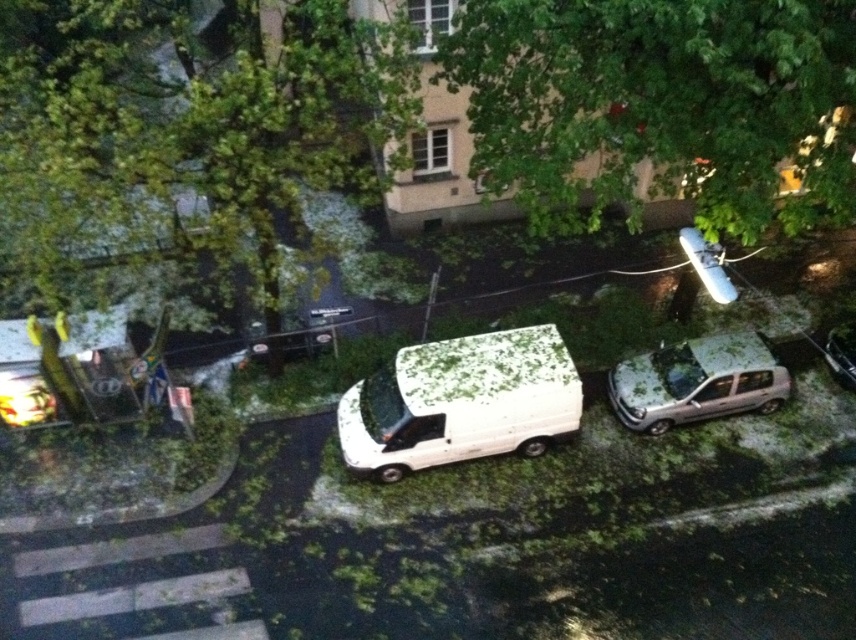
Question: Where is green leafy tree at upper center located in relation to metallic silver surfboard at upper right in the image?

Choices:
 (A) right
 (B) left

Answer: (B)

Question: Which of the following is the closest to the observer?

Choices:
 (A) green leafy tree at upper center
 (B) metallic silver surfboard at upper right

Answer: (B)

Question: Can you confirm if green leafy tree at upper center is smaller than metallic silver surfboard at upper right?

Choices:
 (A) yes
 (B) no

Answer: (A)

Question: Which object is positioned farthest from the green leafy tree at upper center?

Choices:
 (A) white matte van at center
 (B) metallic silver surfboard at upper right
 (C) metallic silver minivan at center-right
 (D) green leafy tree at upper left

Answer: (D)

Question: Which point is farther to the camera?

Choices:
 (A) (728, 284)
 (B) (705, 365)
 (C) (831, 12)
 (D) (82, 180)

Answer: (B)

Question: Is green leafy tree at upper center smaller than white matte van at center?

Choices:
 (A) no
 (B) yes

Answer: (B)